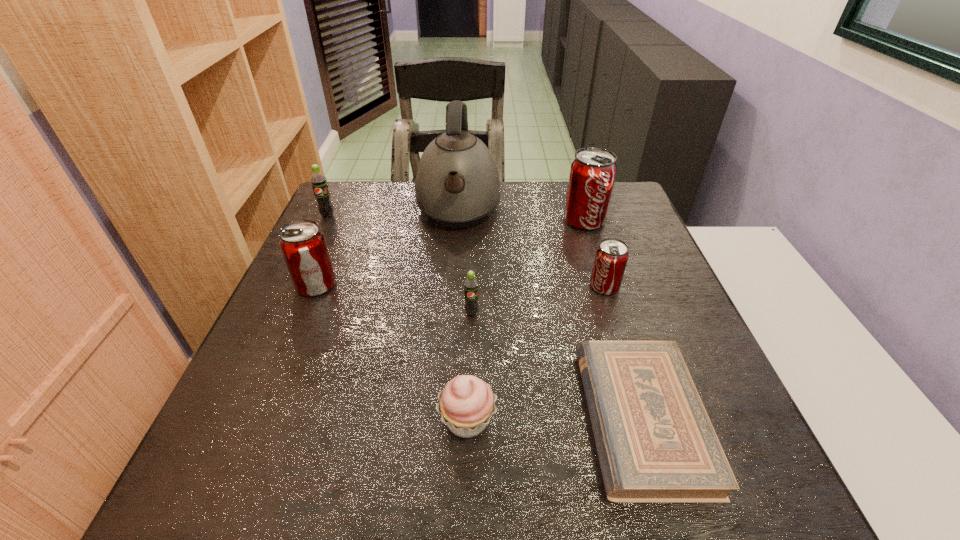
At what (x,y) coordinates should I click in order to perform the action: click on vacant area located 0.300m on the spine side of the Bible. Please return your answer as a coordinate pair (x, y). Looking at the image, I should click on (415, 419).

Where is `free space located 0.140m on the spine side of the Bible`? Image resolution: width=960 pixels, height=540 pixels. free space located 0.140m on the spine side of the Bible is located at coordinates click(507, 419).

The image size is (960, 540). What are the coordinates of `free space located 0.310m on the spine side of the Bible` in the screenshot? It's located at 409,419.

What are the coordinates of `kettle at the far edge` in the screenshot? It's located at (457, 184).

Where is `object that is at the near edge`? Image resolution: width=960 pixels, height=540 pixels. object that is at the near edge is located at coordinates (655, 442).

Where is `Bible positioned at the right edge`? Bible positioned at the right edge is located at coordinates (655, 442).

Find the location of a particular element. This screenshot has height=540, width=960. object at the far left corner is located at coordinates (319, 182).

Find the location of a particular element. This screenshot has height=540, width=960. object located in the far right corner section of the desktop is located at coordinates (592, 175).

Where is `object located in the near right corner section of the desktop`? The height and width of the screenshot is (540, 960). object located in the near right corner section of the desktop is located at coordinates (655, 442).

Identify the location of vacant space at the far edge of the desktop. (525, 221).